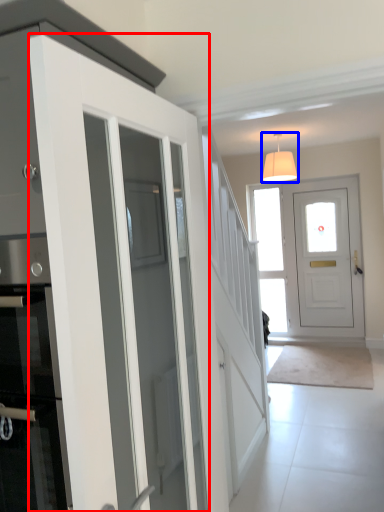
Question: Which object appears farthest to the camera in this image, door (highlighted by a red box) or lamp (highlighted by a blue box)?

Choices:
 (A) door
 (B) lamp

Answer: (B)